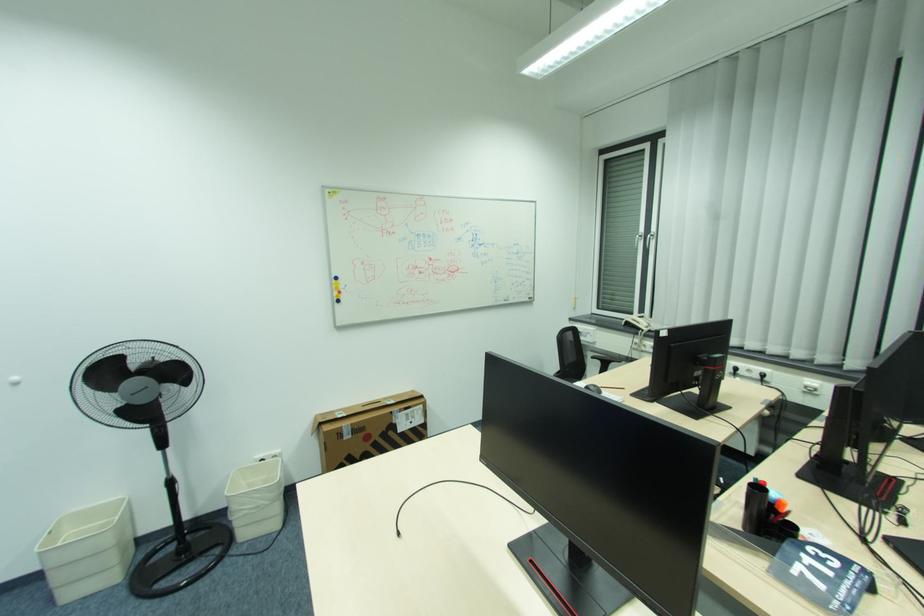
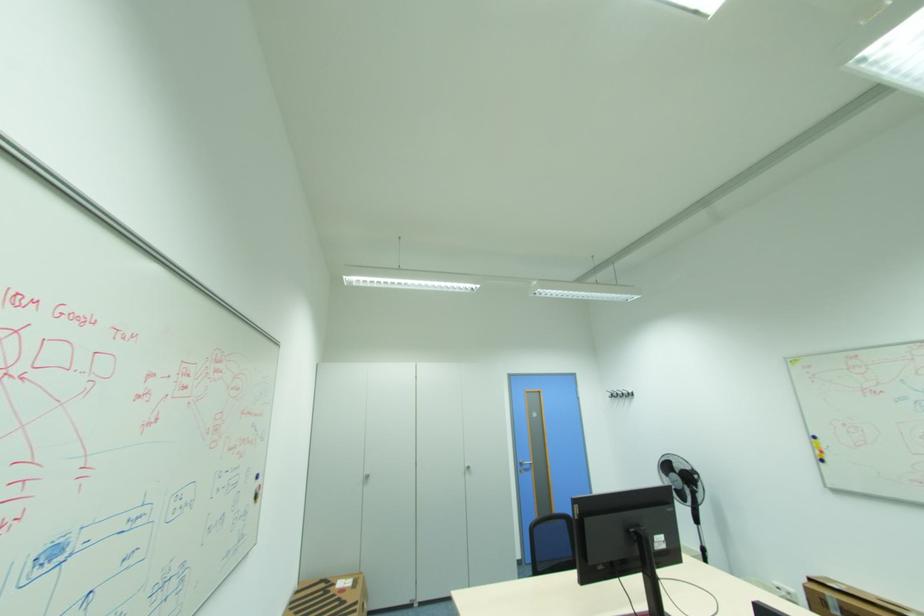
Question: I am providing you with two images of the same scene from different viewpoints. After the viewpoint changes to image2, which objects are now occluded?

Choices:
 (A) silver cabinet handle
 (B) silver door handle
 (C) black wall hook
 (D) none of these

Answer: (D)